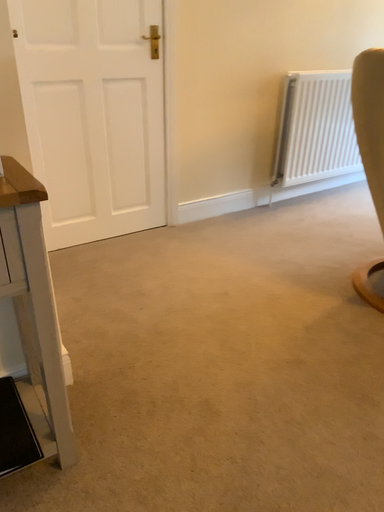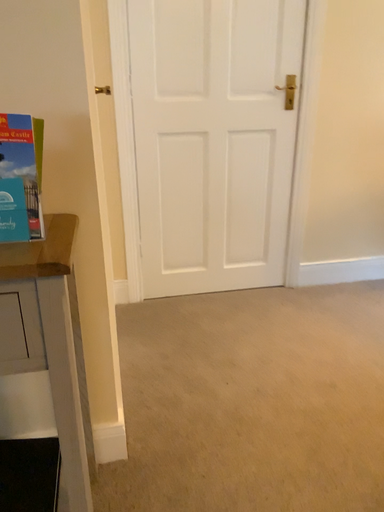
Question: Which way did the camera rotate in the video?

Choices:
 (A) rotated right
 (B) rotated left

Answer: (B)